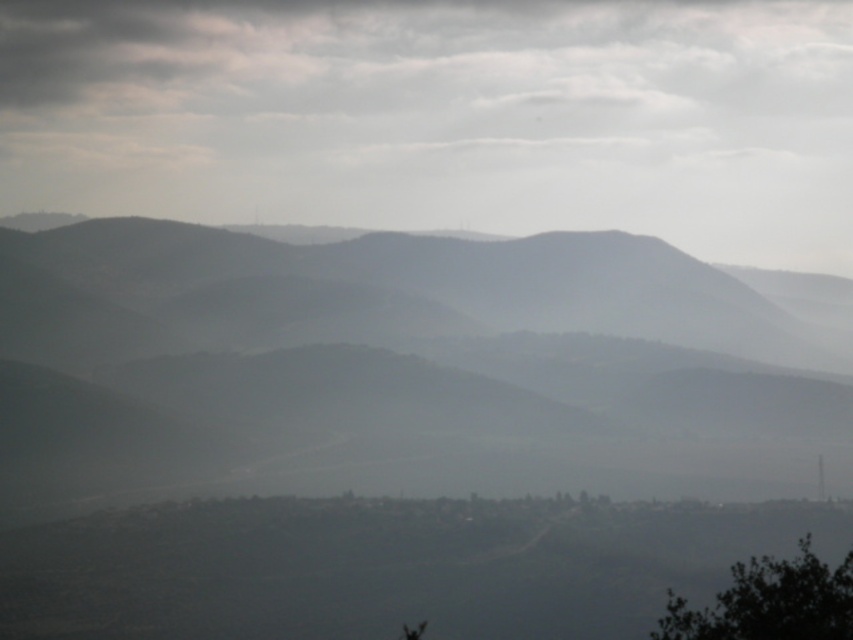
You are an outdoor photographer wanting to capture the gray matte mountain range at center and the green leafy tree at lower right in a single frame. Based on their positions, which object will appear closer to the bottom edge of your photo?

The gray matte mountain range at center is located below the green leafy tree at lower right, so the gray matte mountain range at center will appear closer to the bottom edge of the photo.

You are a hiker standing at the base of the gray matte mountain range at center and the green leafy tree at lower right. Which object would you need to look upward more to see the top of?

The gray matte mountain range at center has a greater height compared to the green leafy tree at lower right, so you would need to look upward more to see the top of the gray matte mountain range at center.